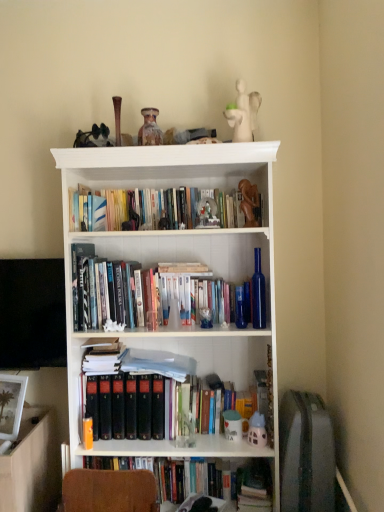
Question: Does white matte figurine at upper center, which is the third toy in right-to-left order, come behind matte white toy at center, the 4th toy from the right?

Choices:
 (A) yes
 (B) no

Answer: (B)

Question: Is white matte figurine at upper center, positioned as the 5th toy in bottom-to-top order, directly adjacent to matte white toy at center, the 4th toy from the right?

Choices:
 (A) no
 (B) yes

Answer: (A)

Question: Is white matte figurine at upper center, which ranks as the first toy in top-to-bottom order, far from matte white toy at center, arranged as the first toy when ordered from the bottom?

Choices:
 (A) no
 (B) yes

Answer: (B)

Question: From a real-world perspective, is white matte figurine at upper center, which is the third toy in right-to-left order, on top of matte white toy at center, the fifth toy in the top-to-bottom sequence?

Choices:
 (A) no
 (B) yes

Answer: (B)

Question: Considering the relative sizes of white matte figurine at upper center, which is the third toy in right-to-left order, and matte white toy at center, the 4th toy from the right, in the image provided, is white matte figurine at upper center, which is the third toy in right-to-left order, taller than matte white toy at center, the 4th toy from the right,?

Choices:
 (A) yes
 (B) no

Answer: (A)

Question: Does white matte figurine at upper center, which is the third toy in right-to-left order, have a larger size compared to matte white toy at center, arranged as the first toy when ordered from the bottom?

Choices:
 (A) no
 (B) yes

Answer: (B)

Question: Is white matte figurine at upper center, which is the third toy in right-to-left order, to the left of white wood bookcase at center from the viewer's perspective?

Choices:
 (A) no
 (B) yes

Answer: (A)

Question: Does white matte figurine at upper center, positioned as the 5th toy in bottom-to-top order, have a smaller size compared to white wood bookcase at center?

Choices:
 (A) yes
 (B) no

Answer: (A)

Question: Is white matte figurine at upper center, which is the third toy in right-to-left order, positioned in front of white wood bookcase at center?

Choices:
 (A) yes
 (B) no

Answer: (B)

Question: Is white matte figurine at upper center, which is the third toy in right-to-left order, wider than white wood bookcase at center?

Choices:
 (A) no
 (B) yes

Answer: (A)

Question: Could you tell me if white matte figurine at upper center, which is the third toy in right-to-left order, is facing white wood bookcase at center?

Choices:
 (A) yes
 (B) no

Answer: (B)

Question: Is white matte figurine at upper center, which ranks as the first toy in top-to-bottom order, behind white wood bookcase at center?

Choices:
 (A) no
 (B) yes

Answer: (B)

Question: From a real-world perspective, does white matte figurine at upper center, acting as the third toy starting from the left, sit lower than speckled ceramic vase at upper center, arranged as the 2th toy when viewed from the top?

Choices:
 (A) yes
 (B) no

Answer: (B)